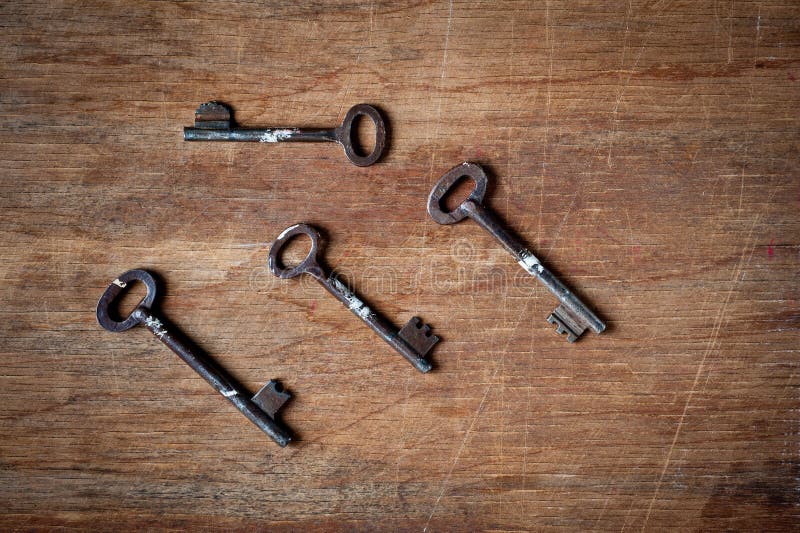
At what (x,y) coordinates should I click in order to perform the action: click on keys. Please return your answer as a coordinate pair (x, y). Looking at the image, I should click on (162, 340), (350, 298), (506, 238), (290, 134).